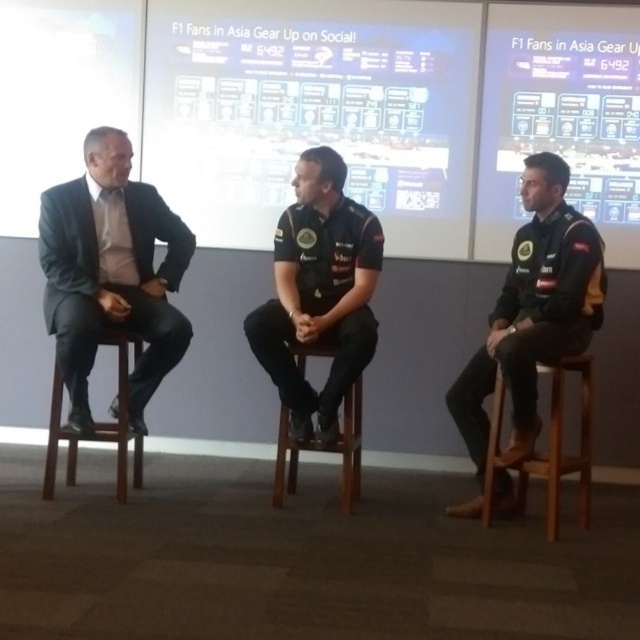
Does matte black screen at upper center appear on the right side of brown wooden stool at left?

Indeed, matte black screen at upper center is positioned on the right side of brown wooden stool at left.

Between point (618, 230) and point (54, 461), which one is positioned behind?

Positioned behind is point (618, 230).

You are a GUI agent. You are given a task and a screenshot of the screen. Output one action in this format:
    pyautogui.click(x=<x>, y=<y>)
    Task: Click on the matte black screen at upper center
    
    Given the screenshot: What is the action you would take?
    pyautogui.click(x=561, y=118)

Can you confirm if white glossy projection screen at center is positioned above matte black screen at upper center?

Yes, white glossy projection screen at center is above matte black screen at upper center.

Who is more forward, [291,198] or [552,4]?

Point [552,4] is more forward.

The width and height of the screenshot is (640, 640). Describe the element at coordinates (312, 113) in the screenshot. I see `white glossy projection screen at center` at that location.

The height and width of the screenshot is (640, 640). I want to click on white glossy projection screen at center, so pos(312,113).

Which of these two, dark gray jersey at center or wooden stool at center, stands taller?

dark gray jersey at center is taller.

Is dark gray jersey at center in front of wooden stool at center?

Yes, it is.

Which is behind, point (541, 314) or point (278, 497)?

Positioned behind is point (278, 497).

Identify the location of dark gray jersey at center. (532, 310).